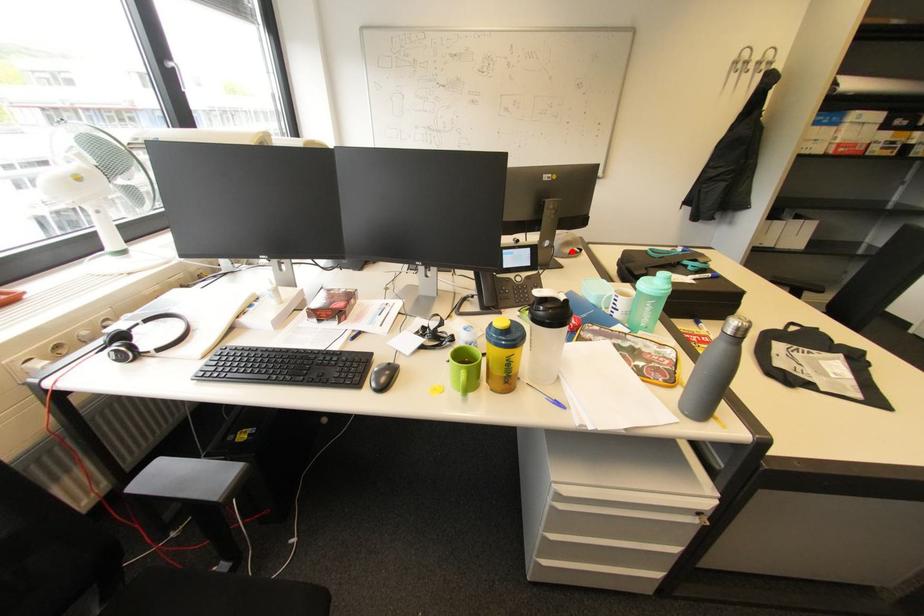
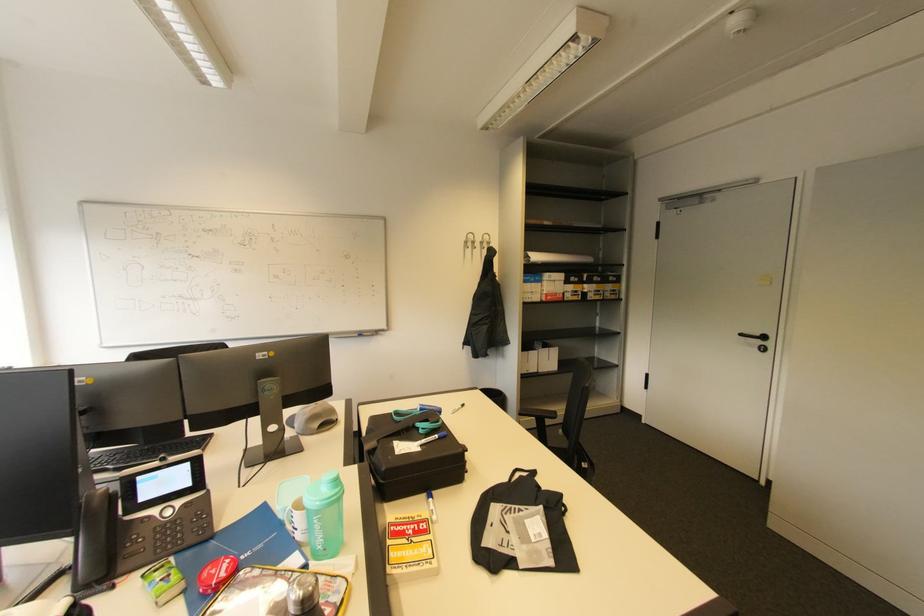
In the second image, find the point that corresponds to the highlighted location in the first image.

(321, 426)